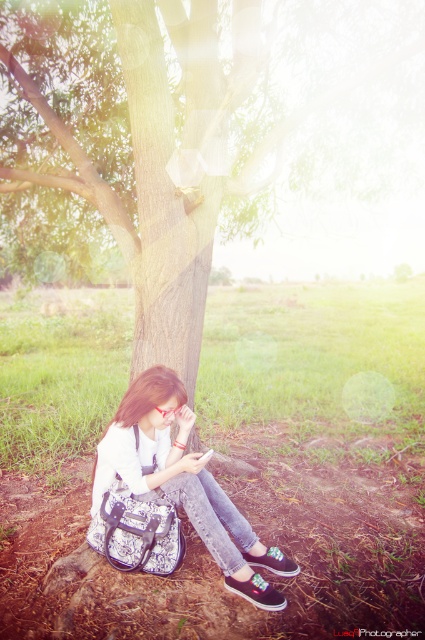
Question: Where is brown rough tree trunk at left located in relation to multicolored fabric shoe at lower center in the image?

Choices:
 (A) above
 (B) below

Answer: (A)

Question: Which is nearer to the brown rough tree trunk at left?

Choices:
 (A) black canvas shoe at lower center
 (B) white textured bag at lower center

Answer: (B)

Question: Which point is closer to the camera?

Choices:
 (A) brown rough tree trunk at left
 (B) black canvas shoe at lower center

Answer: (B)

Question: Which point is closer to the camera taking this photo?

Choices:
 (A) (146, 356)
 (B) (149, 474)

Answer: (B)

Question: From the image, what is the correct spatial relationship of white textured bag at lower center in relation to black canvas shoe at lower center?

Choices:
 (A) right
 (B) left

Answer: (B)

Question: Does white textured bag at lower center have a larger size compared to brown rough tree trunk at left?

Choices:
 (A) yes
 (B) no

Answer: (B)